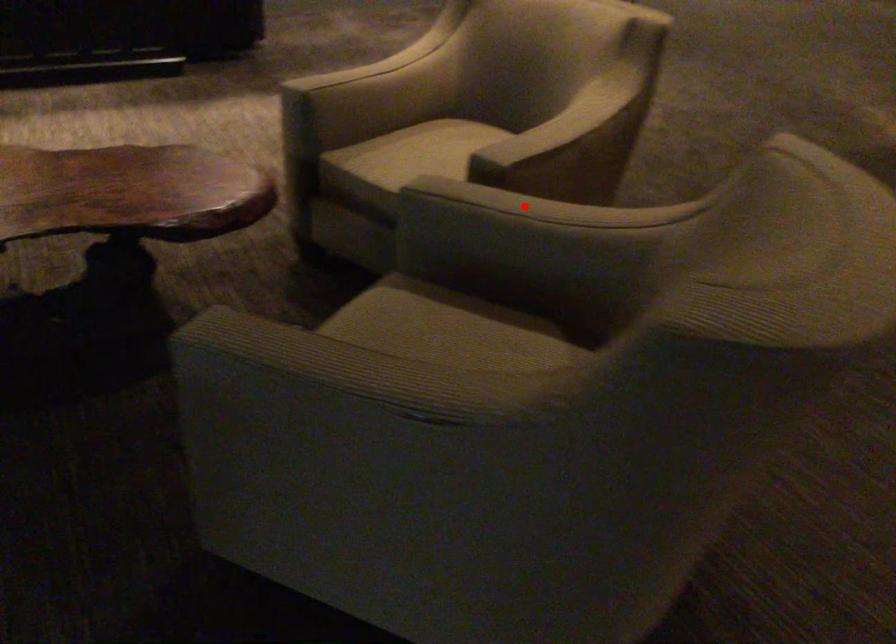
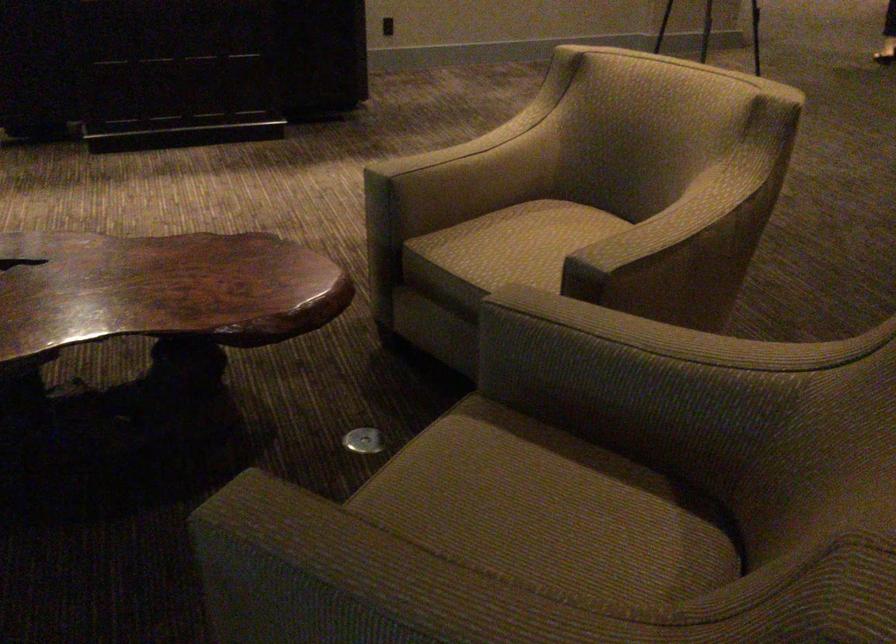
Question: I am providing you with two images of the same scene from different viewpoints. Given a red point in image1, look at the same physical point in image2. Is it:

Choices:
 (A) Closer to the viewpoint
 (B) Farther from the viewpoint

Answer: (A)